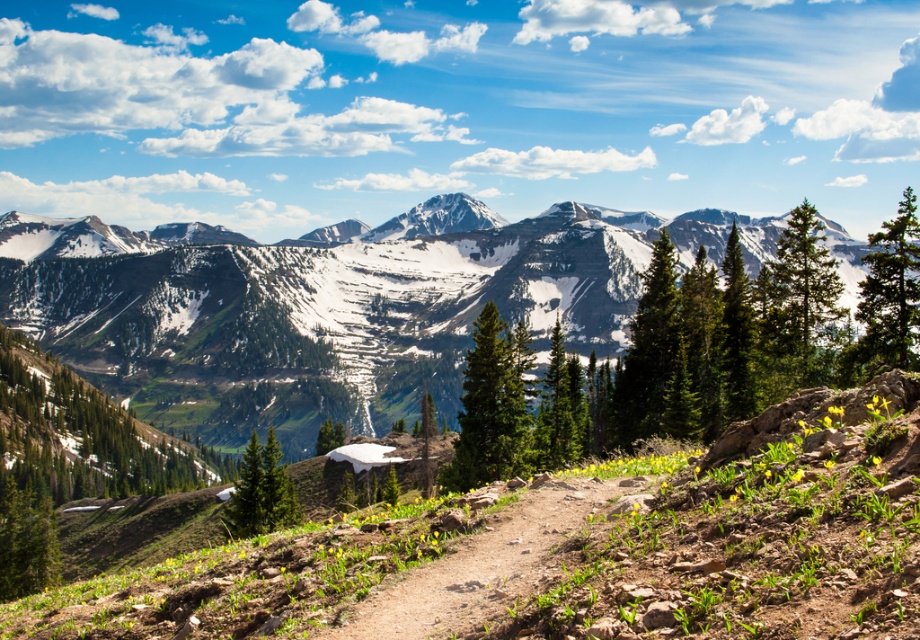
Can you confirm if snowy granite mountains at center is taller than brown dirt path at center?

Indeed, snowy granite mountains at center has a greater height compared to brown dirt path at center.

Is snowy granite mountains at center shorter than brown dirt path at center?

In fact, snowy granite mountains at center may be taller than brown dirt path at center.

Is point (566, 337) positioned before point (500, 540)?

No, (566, 337) is further to viewer.

Where is `snowy granite mountains at center`? snowy granite mountains at center is located at coordinates (330, 305).